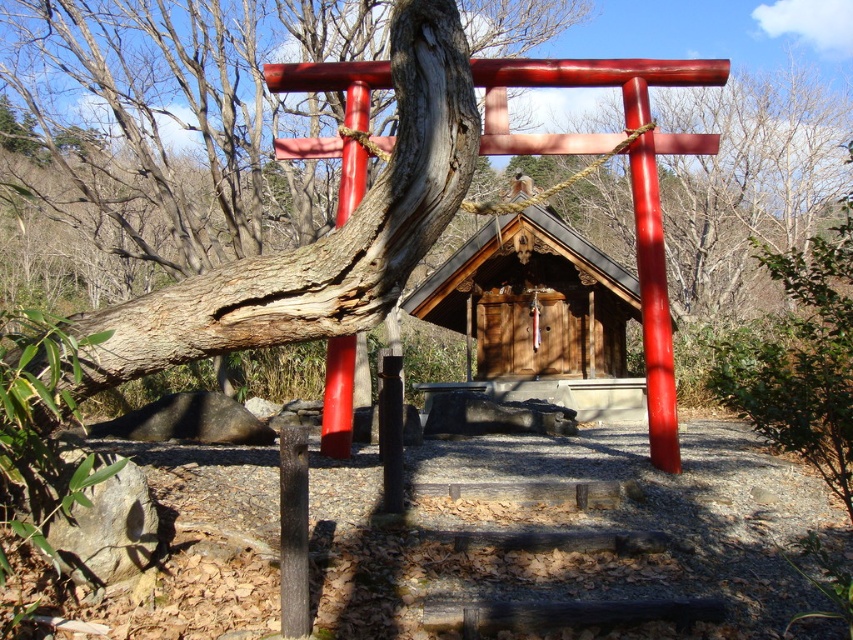
Is wooden hut at center wider than wooden door at center?

Correct, the width of wooden hut at center exceeds that of wooden door at center.

Which of these two, wooden hut at center or wooden door at center, stands shorter?

Standing shorter between the two is wooden door at center.

Identify the location of wooden hut at center. The height and width of the screenshot is (640, 853). (537, 316).